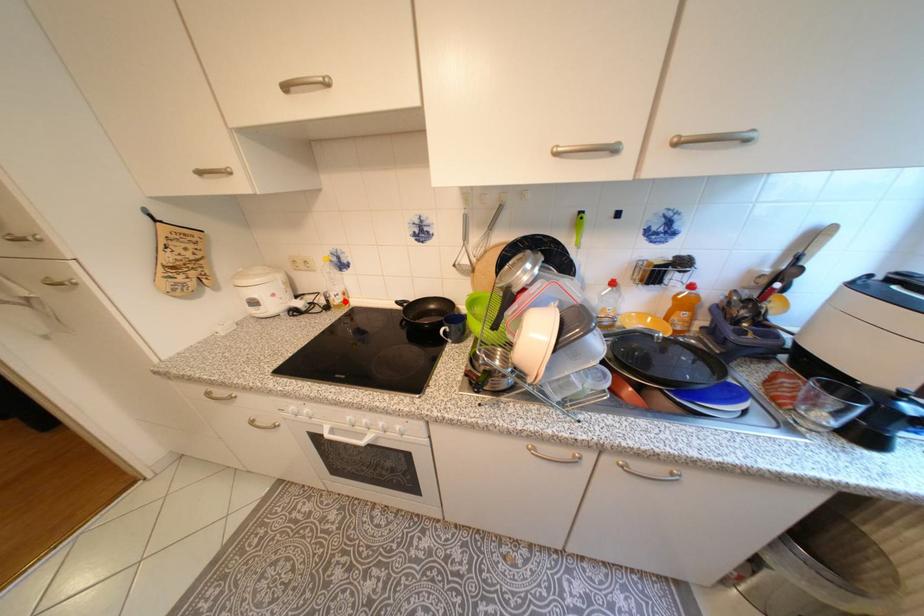
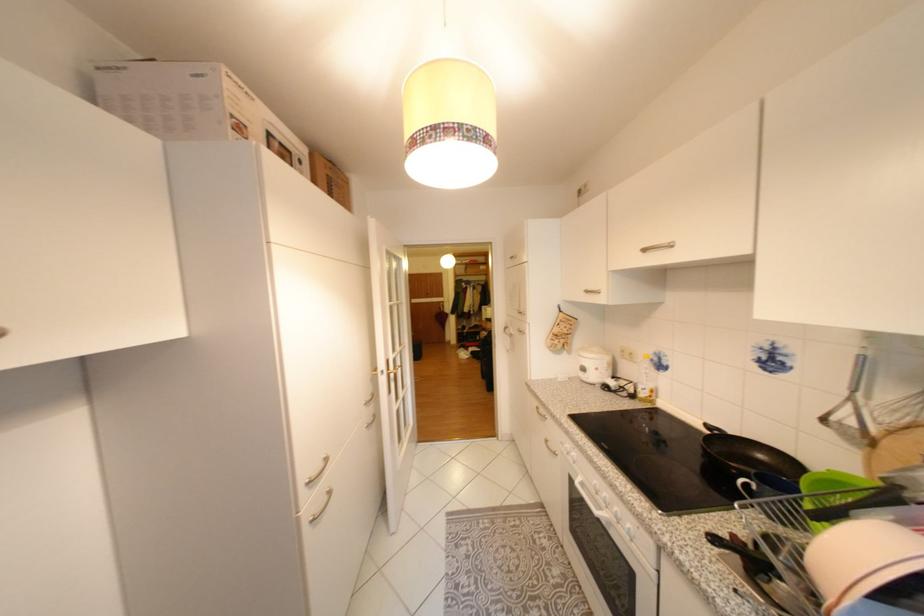
Find the pixel in the second image that matches the highlighted location in the first image.

(651, 395)